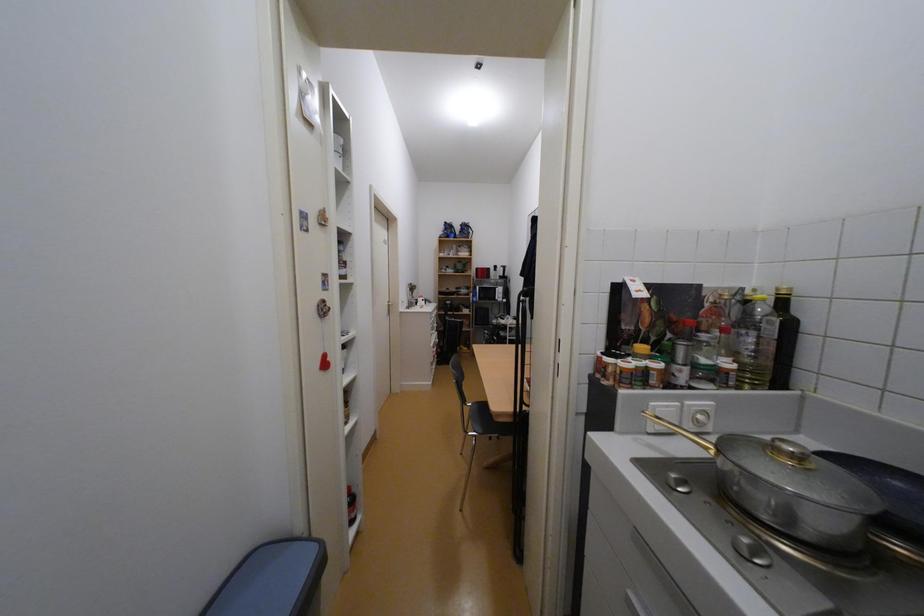
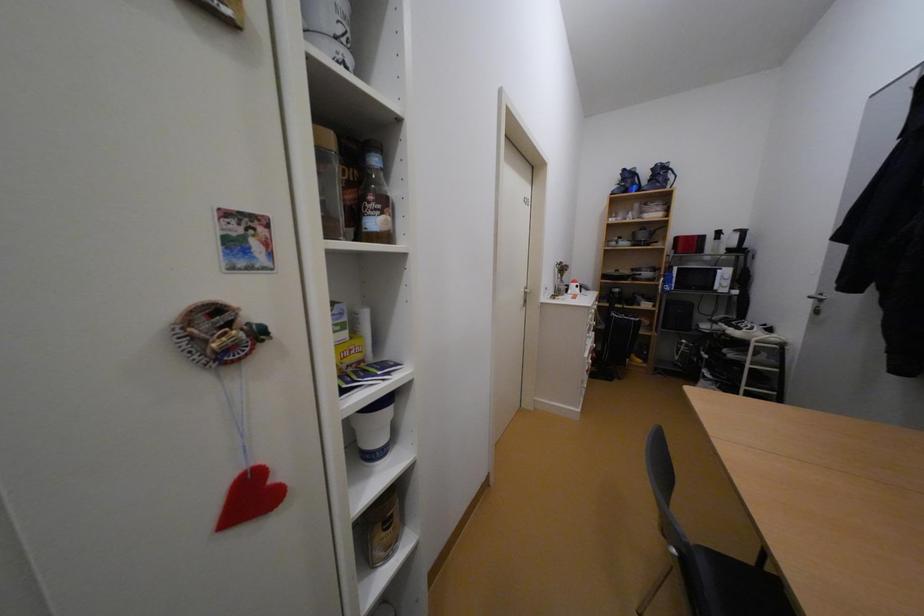
Question: The camera is either moving clockwise (left) or counter-clockwise (right) around the object. The first image is from the beginning of the video and the second image is from the end. Is the camera moving left or right when shooting the video?

Choices:
 (A) Left
 (B) Right

Answer: (B)